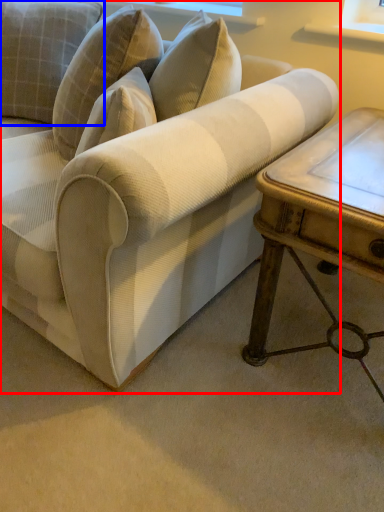
Question: Which object appears farthest to the camera in this image, studio couch (highlighted by a red box) or pillow (highlighted by a blue box)?

Choices:
 (A) studio couch
 (B) pillow

Answer: (B)